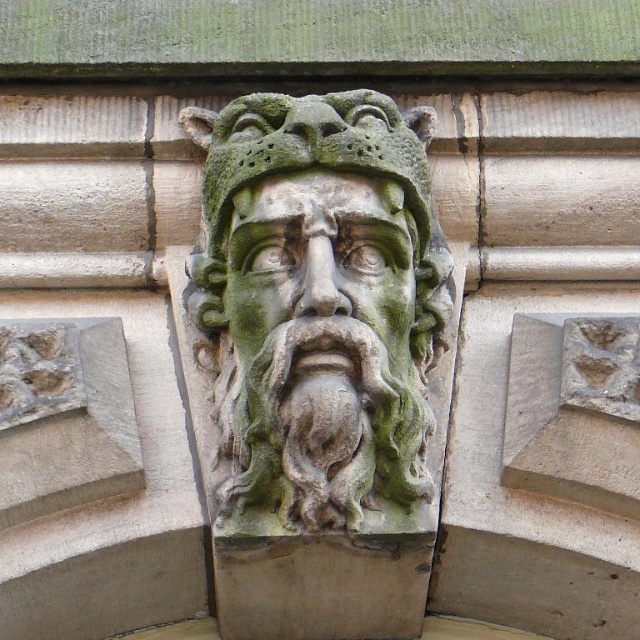
Which of these two, green stone head at center or green stone face at center, stands shorter?

With less height is green stone face at center.

Describe the element at coordinates (317, 301) in the screenshot. I see `green stone head at center` at that location.

Locate an element on the screen. green stone head at center is located at coordinates (317, 301).

The image size is (640, 640). Identify the location of green stone head at center. (317, 301).